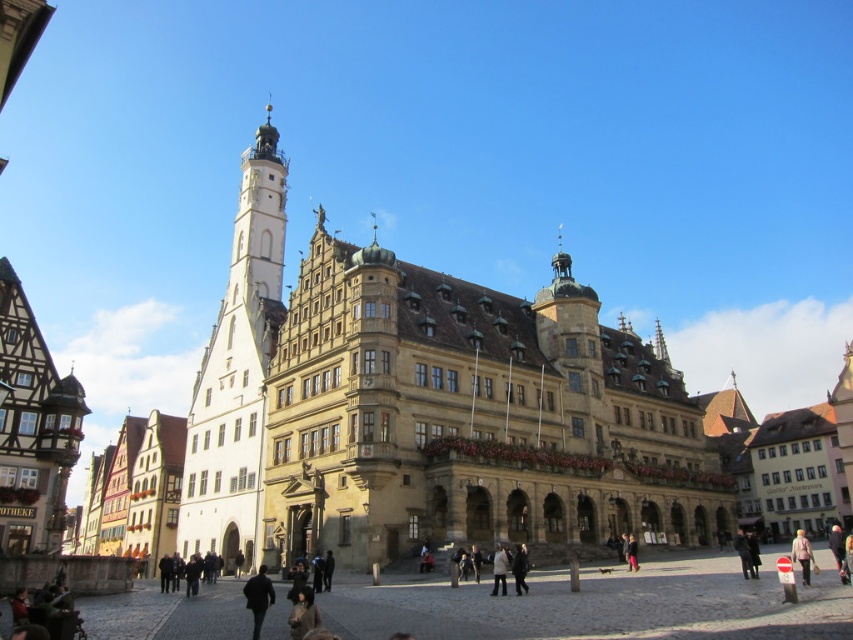
You are standing in the European town square and see the light beige fabric coat at lower right. What is the exact 2D coordinate of its position?

The exact 2D coordinate of the light beige fabric coat at lower right is point (x=802, y=554).

You are standing in the town square and see a light beige fabric coat at lower right and a light beige jacket at center. Which one is positioned further to the right?

The light beige fabric coat at lower right is positioned further to the right than the light beige jacket at center.